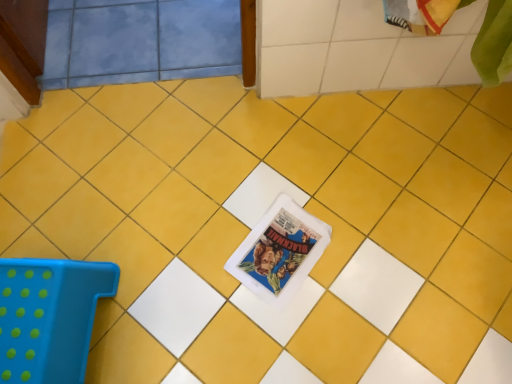
Identify the location of free space in front of matte plastic comic book at center. (286, 333).